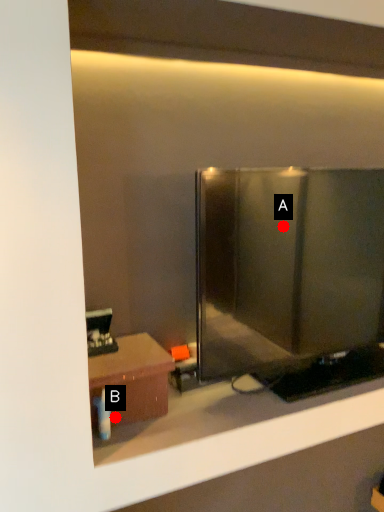
Question: Two points are circled on the image, labeled by A and B beside each circle. Which point appears closest to the camera in this image?

Choices:
 (A) A is closer
 (B) B is closer

Answer: (B)